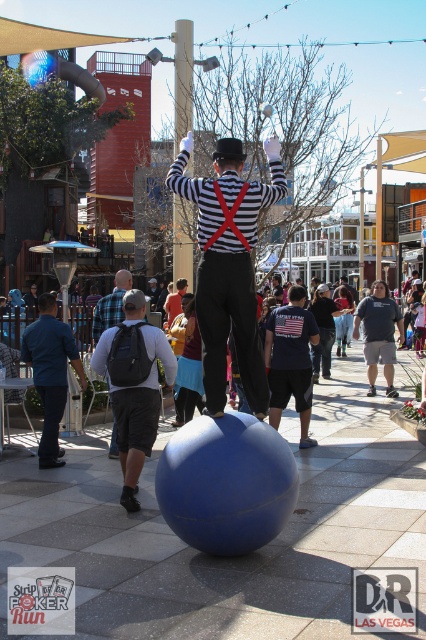
Question: Which of the following is the closest to the observer?

Choices:
 (A) (253, 396)
 (B) (126, 502)
 (C) (80, 381)
 (D) (112, 320)

Answer: (A)

Question: Observing the image, what is the correct spatial positioning of striped fabric magician at center in reference to blue denim shirt at lower left?

Choices:
 (A) left
 (B) right

Answer: (B)

Question: Is striped fabric magician at center further to the viewer compared to blue denim shirt at lower left?

Choices:
 (A) no
 (B) yes

Answer: (A)

Question: Can you confirm if striped fabric magician at center is positioned to the left of dark gray backpack at center?

Choices:
 (A) no
 (B) yes

Answer: (A)

Question: Which point is closer to the camera taking this photo?

Choices:
 (A) (233, 186)
 (B) (48, 348)

Answer: (A)

Question: Which of the following is the closest to the observer?

Choices:
 (A) (52, 356)
 (B) (155, 381)
 (C) (236, 342)
 (D) (112, 308)

Answer: (C)